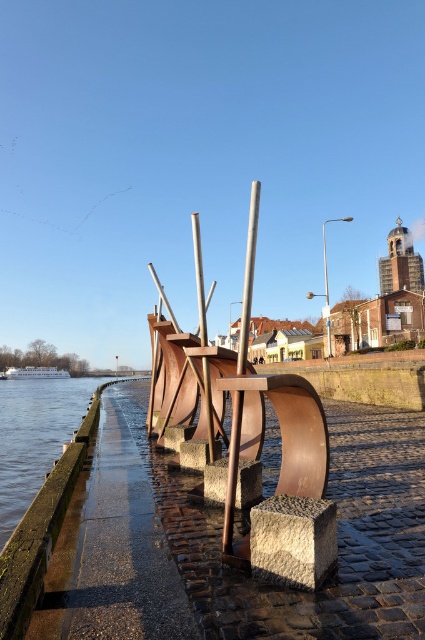
Who is positioned more to the right, smooth wood pole at center or polished metal pole at center?

smooth wood pole at center is more to the right.

Which is behind, point (243, 365) or point (197, 237)?

Point (197, 237)

Who is more forward, (224, 524) or (198, 304)?

Point (224, 524) is in front.

At what (x,y) coordinates should I click in order to perform the action: click on smooth wood pole at center. Please return your answer as a coordinate pair (x, y). Looking at the image, I should click on (248, 276).

What do you see at coordinates (282, 465) in the screenshot?
I see `rusty metal sculpture at center` at bounding box center [282, 465].

Which of these two, rusty metal sculpture at center or smooth wood pole at center, stands taller?

rusty metal sculpture at center is taller.

Is point (272, 540) more distant than point (252, 196)?

No, (272, 540) is closer to viewer.

Locate an element on the screen. Image resolution: width=425 pixels, height=640 pixels. rusty metal sculpture at center is located at coordinates (282, 465).

Which is in front, point (204, 355) or point (209, 424)?

Point (204, 355)

From the picture: Can you confirm if rusty metal sculpture at center is positioned below polished metal pole at center?

No.

What do you see at coordinates (282, 465) in the screenshot?
I see `rusty metal sculpture at center` at bounding box center [282, 465].

Locate an element on the screen. This screenshot has height=640, width=425. rusty metal sculpture at center is located at coordinates (282, 465).